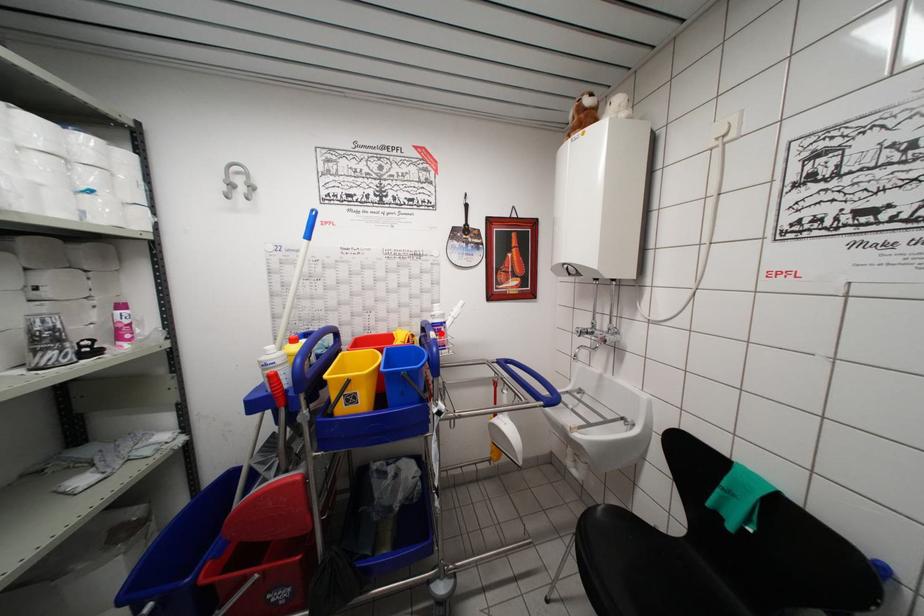
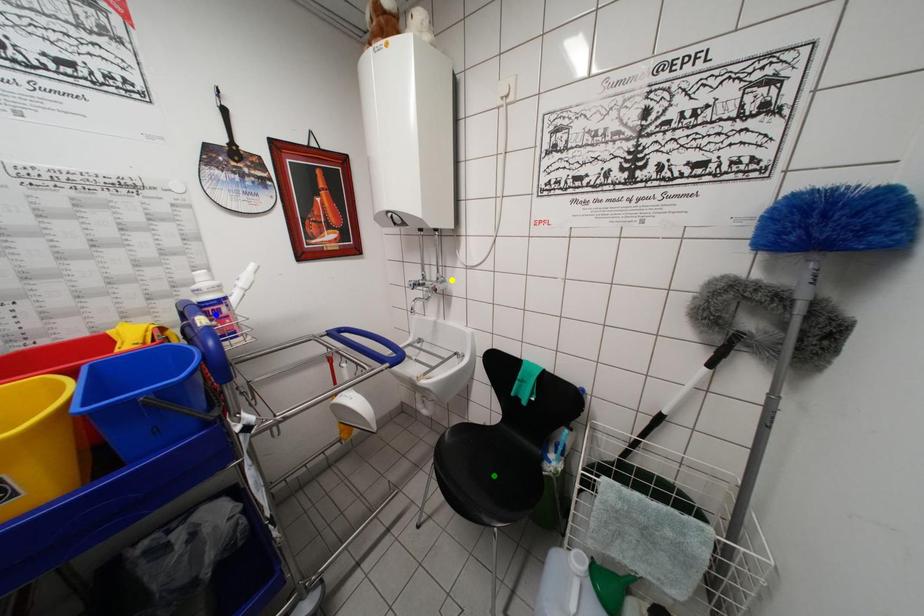
Question: I am providing you with two images of the same scene from different viewpoints. A red point is marked on the first image. You are given multiple points on the second image. In image 2, which mark is for the same physical point as the one in image 1?

Choices:
 (A) green point
 (B) blue point
 (C) yellow point

Answer: (B)